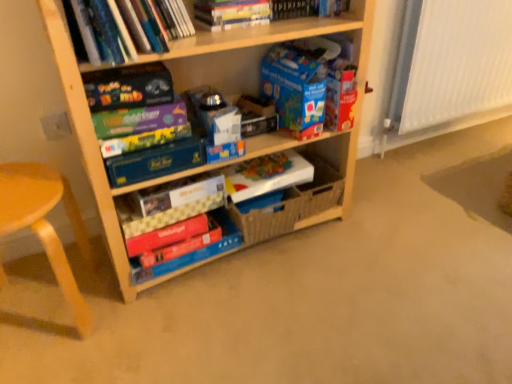
Describe the element at coordinates (231, 13) in the screenshot. I see `hardcover book at upper center, placed as the second book when sorted from top to bottom` at that location.

This screenshot has width=512, height=384. Identify the location of matte board game at upper left, which is the sixth paperback book from bottom to top. (139, 119).

The height and width of the screenshot is (384, 512). I want to click on wooden at left, so click(x=46, y=224).

Measure the distance between point [69,294] and camera.

The depth of point [69,294] is 1.15 meters.

The width and height of the screenshot is (512, 384). What do you see at coordinates (191, 252) in the screenshot? I see `red cardboard book at lower center, acting as the fourth book starting from the top` at bounding box center [191, 252].

At what (x,y) coordinates should I click in order to perform the action: click on hardcover book at center, which is the second paperback book in bottom-to-top order. Please return your answer as a coordinate pair (x, y). The height and width of the screenshot is (384, 512). Looking at the image, I should click on pos(176,193).

Identify the location of hardcover book at upper left, which is the 2th book in bottom-to-top order. The width and height of the screenshot is (512, 384). 127,27.

Could you tell me if white paper at center, arranged as the 6th paperback book when viewed from the top, is facing blue cardboard book at center, the 4th paperback book from the bottom?

No, white paper at center, arranged as the 6th paperback book when viewed from the top, is not facing towards blue cardboard book at center, the 4th paperback book from the bottom.

Which object is closer to the camera, white paper at center, which is counted as the third paperback book, starting from the bottom, or blue cardboard book at center, the 4th paperback book from the bottom?

blue cardboard book at center, the 4th paperback book from the bottom, is closer to the camera.

Which of these two, white paper at center, which is counted as the third paperback book, starting from the bottom, or blue cardboard book at center, the 4th paperback book from the bottom, is wider?

white paper at center, which is counted as the third paperback book, starting from the bottom, is wider.

How many degrees apart are the facing directions of white paper at center, arranged as the 6th paperback book when viewed from the top, and blue cardboard book at center, which ranks as the fifth paperback book in top-to-bottom order?

The facing directions of white paper at center, arranged as the 6th paperback book when viewed from the top, and blue cardboard book at center, which ranks as the fifth paperback book in top-to-bottom order, are 1.91 degrees apart.

Considering the positions of objects red cardboard book at lower center, acting as the fourth book starting from the top, and hardcover book at upper center, which is counted as the 1th book, starting from the top, in the image provided, who is more to the left, red cardboard book at lower center, acting as the fourth book starting from the top, or hardcover book at upper center, which is counted as the 1th book, starting from the top,?

red cardboard book at lower center, acting as the fourth book starting from the top.

From the picture: Is red cardboard book at lower center, acting as the 1th book starting from the bottom, in contact with hardcover book at upper center, which is counted as the 1th book, starting from the top?

No, red cardboard book at lower center, acting as the 1th book starting from the bottom, is not next to hardcover book at upper center, which is counted as the 1th book, starting from the top.

From a real-world perspective, is red cardboard book at lower center, acting as the 1th book starting from the bottom, above or below hardcover book at upper center, the 4th book ordered from the bottom?

red cardboard book at lower center, acting as the 1th book starting from the bottom, is situated lower than hardcover book at upper center, the 4th book ordered from the bottom, in the real world.

Is red cardboard book at lower center, acting as the fourth book starting from the top, oriented away from hardcover book at upper center, which is counted as the 1th book, starting from the top?

No, hardcover book at upper center, which is counted as the 1th book, starting from the top, is not at the back of red cardboard book at lower center, acting as the fourth book starting from the top.

In the scene shown: Which is behind, matte red book at center, which appears as the 8th paperback book when viewed from the top, or multicolored cardboard game box at center, the 5th paperback book when ordered from bottom to top?

Positioned behind is matte red book at center, which appears as the 8th paperback book when viewed from the top.

Is point (146, 233) behind point (189, 124)?

Yes, point (146, 233) is behind point (189, 124).

Where is `the 4th paperback book positioned above the matte red book at center, the first paperback book when ordered from bottom to top (from the image's perspective)`? The width and height of the screenshot is (512, 384). the 4th paperback book positioned above the matte red book at center, the first paperback book when ordered from bottom to top (from the image's perspective) is located at coordinates (144, 140).

Is matte red book at center, the first paperback book when ordered from bottom to top, bigger than multicolored cardboard game box at center, the fourth paperback book in the top-to-bottom sequence?

Indeed, matte red book at center, the first paperback book when ordered from bottom to top, has a larger size compared to multicolored cardboard game box at center, the fourth paperback book in the top-to-bottom sequence.

Is point (178, 17) positioned in front of point (2, 215)?

No, it is not.

Would you say hardcover book at upper left, the third book positioned from the top, is to the left or to the right of wooden at left in the picture?

Based on their positions, hardcover book at upper left, the third book positioned from the top, is located to the right of wooden at left.

Is hardcover book at upper left, the third book positioned from the top, positioned with its back to wooden at left?

hardcover book at upper left, the third book positioned from the top, does not have its back to wooden at left.

From a real-world perspective, is hardcover book at upper left, which is the 2th book in bottom-to-top order, positioned above or below wooden at left?

In terms of real-world spatial position, hardcover book at upper left, which is the 2th book in bottom-to-top order, is above wooden at left.

From the image's perspective, is blue cardboard box at upper center, which is the eighth paperback book in bottom-to-top order, above red cardboard book at lower center, acting as the 1th book starting from the bottom?

Indeed, from the image's perspective, blue cardboard box at upper center, which is the eighth paperback book in bottom-to-top order, is shown above red cardboard book at lower center, acting as the 1th book starting from the bottom.

Would you say blue cardboard box at upper center, which is the eighth paperback book in bottom-to-top order, is to the left or to the right of red cardboard book at lower center, acting as the fourth book starting from the top, in the picture?

Based on their positions, blue cardboard box at upper center, which is the eighth paperback book in bottom-to-top order, is located to the right of red cardboard book at lower center, acting as the fourth book starting from the top.

Is blue cardboard box at upper center, positioned as the 1th paperback book in top-to-bottom order, aimed at red cardboard book at lower center, acting as the 1th book starting from the bottom?

No.

Looking at their sizes, would you say blue cardboard box at upper center, which is the eighth paperback book in bottom-to-top order, is wider or thinner than red cardboard book at lower center, acting as the 1th book starting from the bottom?

blue cardboard box at upper center, which is the eighth paperback book in bottom-to-top order, is wider than red cardboard book at lower center, acting as the 1th book starting from the bottom.

From the image's perspective, is matte red book at center, which appears as the 8th paperback book when viewed from the top, located above or below hardcover book at upper center, placed as the second book when sorted from top to bottom?

Clearly, from the image's perspective, matte red book at center, which appears as the 8th paperback book when viewed from the top, is below hardcover book at upper center, placed as the second book when sorted from top to bottom.

Are matte red book at center, the first paperback book when ordered from bottom to top, and hardcover book at upper center, placed as the second book when sorted from top to bottom, far apart?

matte red book at center, the first paperback book when ordered from bottom to top, is near hardcover book at upper center, placed as the second book when sorted from top to bottom, not far away.

Which object is closer to the camera taking this photo, matte red book at center, which appears as the 8th paperback book when viewed from the top, or hardcover book at upper center, the third book ordered from the bottom?

hardcover book at upper center, the third book ordered from the bottom, is in front.

Does matte red book at center, which appears as the 8th paperback book when viewed from the top, have a greater height compared to hardcover book at upper center, placed as the second book when sorted from top to bottom?

No, matte red book at center, which appears as the 8th paperback book when viewed from the top, is not taller than hardcover book at upper center, placed as the second book when sorted from top to bottom.

Does hardcover book at upper left, which is the 2th book in bottom-to-top order, appear on the left side of hardcover book at upper center, the third book ordered from the bottom?

Yes.

From a real-world perspective, which is physically above, hardcover book at upper left, which is the 2th book in bottom-to-top order, or hardcover book at upper center, placed as the second book when sorted from top to bottom?

hardcover book at upper center, placed as the second book when sorted from top to bottom, is physically above.

Does point (122, 48) lie behind point (199, 11)?

No, (122, 48) is in front of (199, 11).

I want to click on the 2nd paperback book below the blue cardboard book at center, which ranks as the fifth paperback book in top-to-bottom order (from a real-world perspective), so click(x=266, y=175).

What are the coordinates of `the 3rd book positioned below the hardcover book at upper center, the 4th book ordered from the bottom (from the image's perspective)` in the screenshot? It's located at (191, 252).

From the image, which object appears to be farther from red cardboard book at lower center, acting as the fourth book starting from the top, matte black board game at upper left, which is counted as the 2th paperback book, starting from the top, or hardcover book at upper center, the 4th book ordered from the bottom?

hardcover book at upper center, the 4th book ordered from the bottom, is further to red cardboard book at lower center, acting as the fourth book starting from the top.

From the image, which object appears to be farther from hardcover book at upper left, which is the 2th book in bottom-to-top order, wooden at left or hardcover book at upper center, the third book ordered from the bottom?

wooden at left is further to hardcover book at upper left, which is the 2th book in bottom-to-top order.

Which object lies further to the anchor point hardcover book at upper center, the third book ordered from the bottom, hardcover book at upper left, the third book positioned from the top, or blue cardboard box at upper center, positioned as the 1th paperback book in top-to-bottom order?

Among the two, hardcover book at upper left, the third book positioned from the top, is located further to hardcover book at upper center, the third book ordered from the bottom.

Looking at the image, which one is located further to blue cardboard box at upper center, which is the eighth paperback book in bottom-to-top order, hardcover book at upper center, the 4th book ordered from the bottom, or hardcover book at center, which is the second paperback book in bottom-to-top order?

Based on the image, hardcover book at center, which is the second paperback book in bottom-to-top order, appears to be further to blue cardboard box at upper center, which is the eighth paperback book in bottom-to-top order.

From the image, which object appears to be farther from wooden shelf at center, multicolored cardboard game box at center, the 5th paperback book when ordered from bottom to top, or hardcover book at upper center, the 4th book ordered from the bottom?

The object further to wooden shelf at center is hardcover book at upper center, the 4th book ordered from the bottom.

When comparing their distances from wooden shelf at center, does blue cardboard box at upper center, positioned as the 1th paperback book in top-to-bottom order, or hardcover book at center, which is the second paperback book in bottom-to-top order, seem further?

The object further to wooden shelf at center is hardcover book at center, which is the second paperback book in bottom-to-top order.

When comparing their distances from wooden shelf at center, does multicolored cardboard game box at center, the fourth paperback book in the top-to-bottom sequence, or hardcover book at upper center, placed as the second book when sorted from top to bottom, seem closer?

hardcover book at upper center, placed as the second book when sorted from top to bottom, lies closer to wooden shelf at center than the other object.

Which object lies further to the anchor point matte black board game at upper left, which is counted as the 2th paperback book, starting from the top, hardcover book at center, marked as the 7th paperback book in a top-to-bottom arrangement, or blue cardboard box at upper center, which is the eighth paperback book in bottom-to-top order?

blue cardboard box at upper center, which is the eighth paperback book in bottom-to-top order, lies further to matte black board game at upper left, which is counted as the 2th paperback book, starting from the top, than the other object.

You are a GUI agent. You are given a task and a screenshot of the screen. Output one action in this format:
    pyautogui.click(x=<x>, y=<y>)
    Task: Click on the book between hardcover book at upper center, placed as the second book when sorted from top to bottom, and wooden at left from top to bottom
    
    Given the screenshot: What is the action you would take?
    pyautogui.click(x=127, y=27)

Where is `book that lies between hardcover book at upper center, the third book ordered from the bottom, and hardcover book at center, marked as the 7th paperback book in a top-to-bottom arrangement, from top to bottom`? The image size is (512, 384). book that lies between hardcover book at upper center, the third book ordered from the bottom, and hardcover book at center, marked as the 7th paperback book in a top-to-bottom arrangement, from top to bottom is located at coordinates (127, 27).

Locate an element on the screen. Image resolution: width=512 pixels, height=384 pixels. book between hardcover book at upper center, the third book ordered from the bottom, and blue cardboard book at center, which ranks as the fifth paperback book in top-to-bottom order, from top to bottom is located at coordinates (127, 27).

At what (x,y) coordinates should I click in order to perform the action: click on chair between hardcover book at upper center, the 4th book ordered from the bottom, and red cardboard book at lower center, acting as the fourth book starting from the top, in the vertical direction. Please return your answer as a coordinate pair (x, y). The width and height of the screenshot is (512, 384). Looking at the image, I should click on (46, 224).